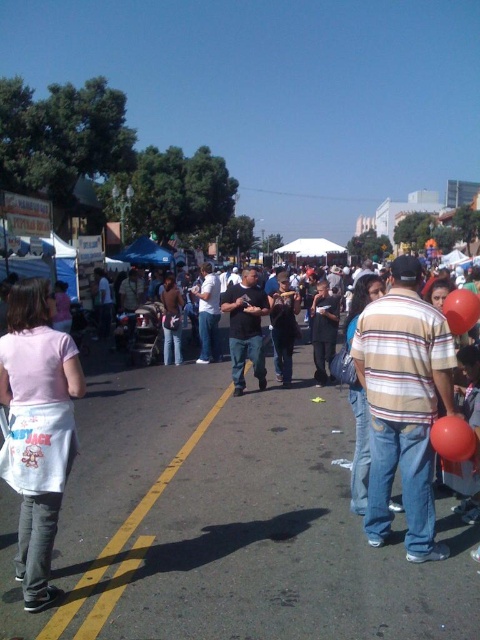
You are standing at the center of the street and see the point marked at coordinates (x=36, y=428). What object is located at that point?

The point at coordinates (x=36, y=428) corresponds to the white cotton apron at lower left.

You are a photographer at the event and want to capture both the white cotton apron at lower left and the red rubber balloon at lower right in the same photo. Based on their positions, will the apron appear higher or lower in the frame compared to the balloon?

The white cotton apron at lower left is above the red rubber balloon at lower right, so in the photo, the apron will appear higher than the balloon.

You are a street performer who needs to decide which item to use for a magic trick. You have the white cotton apron at lower left and the red rubber balloon at lower right. Which item is bigger?

The white cotton apron at lower left is larger in size than the red rubber balloon at lower right, so the apron is bigger.